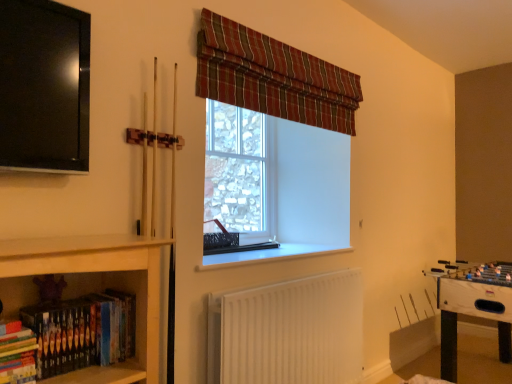
Identify the location of white ribbed radiator at lower center. (288, 332).

Image resolution: width=512 pixels, height=384 pixels. What do you see at coordinates (273, 77) in the screenshot? I see `plaid fabric curtain at upper center` at bounding box center [273, 77].

What is the approximate width of plaid fabric curtain at upper center?

plaid fabric curtain at upper center is 3.32 inches in width.

Describe the element at coordinates (474, 306) in the screenshot. I see `white glossy foosball table at lower right` at that location.

From the picture: Measure the distance between point (486, 314) and camera.

They are 2.73 meters apart.

Measure the distance between clear glass window at center and camera.

A distance of 2.31 meters exists between clear glass window at center and camera.

You are a GUI agent. You are given a task and a screenshot of the screen. Output one action in this format:
    pyautogui.click(x=<x>, y=<y>)
    Task: Click on the clear glass window at center
    This screenshot has width=512, height=384.
    Given the screenshot: What is the action you would take?
    pyautogui.click(x=234, y=168)

What do you see at coordinates (18, 357) in the screenshot?
I see `hardcover books at lower left, acting as the 2th book starting from the right` at bounding box center [18, 357].

In order to click on white ribbed radiator at lower center in this screenshot , I will do `click(288, 332)`.

In the scene shown: Is hardcover books at lower left, the first book in the right-to-left sequence, surrounding plaid fabric curtain at upper center?

Definitely not — plaid fabric curtain at upper center is not inside hardcover books at lower left, the first book in the right-to-left sequence.

Considering the relative positions of hardcover books at lower left, which appears as the second book when viewed from the left, and plaid fabric curtain at upper center in the image provided, is hardcover books at lower left, which appears as the second book when viewed from the left, to the right of plaid fabric curtain at upper center from the viewer's perspective?

Incorrect, hardcover books at lower left, which appears as the second book when viewed from the left, is not on the right side of plaid fabric curtain at upper center.

Considering the positions of point (35, 326) and point (352, 75), is point (35, 326) closer or farther from the camera than point (352, 75)?

Point (35, 326) is positioned closer to the camera compared to point (352, 75).

Is hardcover books at lower left, the first book in the right-to-left sequence, directly adjacent to plaid fabric curtain at upper center?

hardcover books at lower left, the first book in the right-to-left sequence, is not next to plaid fabric curtain at upper center, and they're not touching.

Is white ribbed radiator at lower center smaller than hardcover books at lower left, arranged as the first book when viewed from the left?

No, white ribbed radiator at lower center is not smaller than hardcover books at lower left, arranged as the first book when viewed from the left.

The width and height of the screenshot is (512, 384). Find the location of `radiator lying below the hardcover books at lower left, acting as the 2th book starting from the right (from the image's perspective)`. radiator lying below the hardcover books at lower left, acting as the 2th book starting from the right (from the image's perspective) is located at coordinates (288, 332).

Considering the relative sizes of white ribbed radiator at lower center and hardcover books at lower left, acting as the 2th book starting from the right, in the image provided, is white ribbed radiator at lower center thinner than hardcover books at lower left, acting as the 2th book starting from the right,?

Yes.

How different are the orientations of white ribbed radiator at lower center and hardcover books at lower left, arranged as the first book when viewed from the left, in degrees?

The angular difference between white ribbed radiator at lower center and hardcover books at lower left, arranged as the first book when viewed from the left, is 2.31 degrees.

Does point (281, 295) come closer to viewer compared to point (42, 337)?

No.

Based on the photo, from the image's perspective, is white ribbed radiator at lower center on top of hardcover books at lower left, which appears as the second book when viewed from the left?

No.

From the picture: Can you confirm if white ribbed radiator at lower center is wider than hardcover books at lower left, the first book in the right-to-left sequence?

In fact, white ribbed radiator at lower center might be narrower than hardcover books at lower left, the first book in the right-to-left sequence.

Based on their sizes in the image, would you say white ribbed radiator at lower center is bigger or smaller than hardcover books at lower left, the first book in the right-to-left sequence?

In the image, white ribbed radiator at lower center appears to be larger than hardcover books at lower left, the first book in the right-to-left sequence.

Based on the photo, from the image's perspective, which one is positioned lower, hardcover books at lower left, which appears as the second book when viewed from the left, or white ribbed radiator at lower center?

From the image's view, white ribbed radiator at lower center is below.

Is hardcover books at lower left, which appears as the second book when viewed from the left, touching white ribbed radiator at lower center?

No, hardcover books at lower left, which appears as the second book when viewed from the left, is not touching white ribbed radiator at lower center.

Does hardcover books at lower left, which appears as the second book when viewed from the left, come in front of white ribbed radiator at lower center?

That is True.

How much distance is there between hardcover books at lower left, the first book in the right-to-left sequence, and white ribbed radiator at lower center?

They are 37.36 inches apart.

From a real-world perspective, which is physically above, white glossy foosball table at lower right or plaid fabric curtain at upper center?

From a 3D spatial view, plaid fabric curtain at upper center is above.

Is white glossy foosball table at lower right oriented towards plaid fabric curtain at upper center?

No, white glossy foosball table at lower right is not oriented towards plaid fabric curtain at upper center.

Which object is thinner, white glossy foosball table at lower right or plaid fabric curtain at upper center?

plaid fabric curtain at upper center.

From the image's perspective, between white glossy foosball table at lower right and clear glass window at center, which one is located above?

clear glass window at center is shown above in the image.

Is there a large distance between white glossy foosball table at lower right and clear glass window at center?

white glossy foosball table at lower right is far away from clear glass window at center.

Is point (442, 297) positioned before point (232, 168)?

Yes, it is.

From a real-world perspective, relative to hardcover books at lower left, arranged as the first book when viewed from the left, is clear glass window at center vertically above or below?

clear glass window at center is situated higher than hardcover books at lower left, arranged as the first book when viewed from the left, in the real world.

Find the location of a particular element. This screenshot has width=512, height=384. bay window located above the hardcover books at lower left, arranged as the first book when viewed from the left (from a real-world perspective) is located at coordinates (234, 168).

Is clear glass window at center thinner than hardcover books at lower left, acting as the 2th book starting from the right?

Indeed, clear glass window at center has a lesser width compared to hardcover books at lower left, acting as the 2th book starting from the right.

Can you confirm if clear glass window at center is shorter than hardcover books at lower left, arranged as the first book when viewed from the left?

No.

There is a plaid fabric curtain at upper center. Where is `the 1st book below it (from the image's perspective)`? The width and height of the screenshot is (512, 384). the 1st book below it (from the image's perspective) is located at coordinates (82, 332).

Find the location of a particular element. radiator that is on the right side of hardcover books at lower left, arranged as the first book when viewed from the left is located at coordinates (288, 332).

From the picture: Estimate the real-world distances between objects in this image. Which object is further from hardcover books at lower left, arranged as the first book when viewed from the left, white ribbed radiator at lower center or hardcover books at lower left, the first book in the right-to-left sequence?

white ribbed radiator at lower center is positioned further to the anchor hardcover books at lower left, arranged as the first book when viewed from the left.

Considering their positions, is white glossy foosball table at lower right positioned further to clear glass window at center than plaid fabric curtain at upper center?

white glossy foosball table at lower right is positioned further to the anchor clear glass window at center.

Looking at the image, which one is located further to white plastic window sill at center, hardcover books at lower left, acting as the 2th book starting from the right, or white glossy foosball table at lower right?

hardcover books at lower left, acting as the 2th book starting from the right, is further to white plastic window sill at center.

Consider the image. Looking at the image, which one is located closer to white ribbed radiator at lower center, hardcover books at lower left, arranged as the first book when viewed from the left, or plaid fabric curtain at upper center?

plaid fabric curtain at upper center.

Considering their positions, is white glossy foosball table at lower right positioned closer to hardcover books at lower left, which appears as the second book when viewed from the left, than clear glass window at center?

clear glass window at center is closer to hardcover books at lower left, which appears as the second book when viewed from the left.

Estimate the real-world distances between objects in this image. Which object is further from hardcover books at lower left, which appears as the second book when viewed from the left, hardcover books at lower left, acting as the 2th book starting from the right, or plaid fabric curtain at upper center?

plaid fabric curtain at upper center is positioned further to the anchor hardcover books at lower left, which appears as the second book when viewed from the left.

Estimate the real-world distances between objects in this image. Which object is closer to hardcover books at lower left, the first book in the right-to-left sequence, hardcover books at lower left, acting as the 2th book starting from the right, or white plastic window sill at center?

Among the two, hardcover books at lower left, acting as the 2th book starting from the right, is located nearer to hardcover books at lower left, the first book in the right-to-left sequence.

Which object lies nearer to the anchor point white glossy foosball table at lower right, hardcover books at lower left, acting as the 2th book starting from the right, or white ribbed radiator at lower center?

Based on the image, white ribbed radiator at lower center appears to be nearer to white glossy foosball table at lower right.

In order to click on curtain between hardcover books at lower left, the first book in the right-to-left sequence, and white glossy foosball table at lower right in this screenshot , I will do `click(273, 77)`.

This screenshot has width=512, height=384. Find the location of `radiator between hardcover books at lower left, arranged as the first book when viewed from the left, and clear glass window at center, along the z-axis`. radiator between hardcover books at lower left, arranged as the first book when viewed from the left, and clear glass window at center, along the z-axis is located at coordinates (288, 332).

The image size is (512, 384). I want to click on book between plaid fabric curtain at upper center and hardcover books at lower left, acting as the 2th book starting from the right, in the up-down direction, so click(82, 332).

Where is `bay window that lies between plaid fabric curtain at upper center and white plastic window sill at center from top to bottom`? This screenshot has height=384, width=512. bay window that lies between plaid fabric curtain at upper center and white plastic window sill at center from top to bottom is located at coordinates (234, 168).